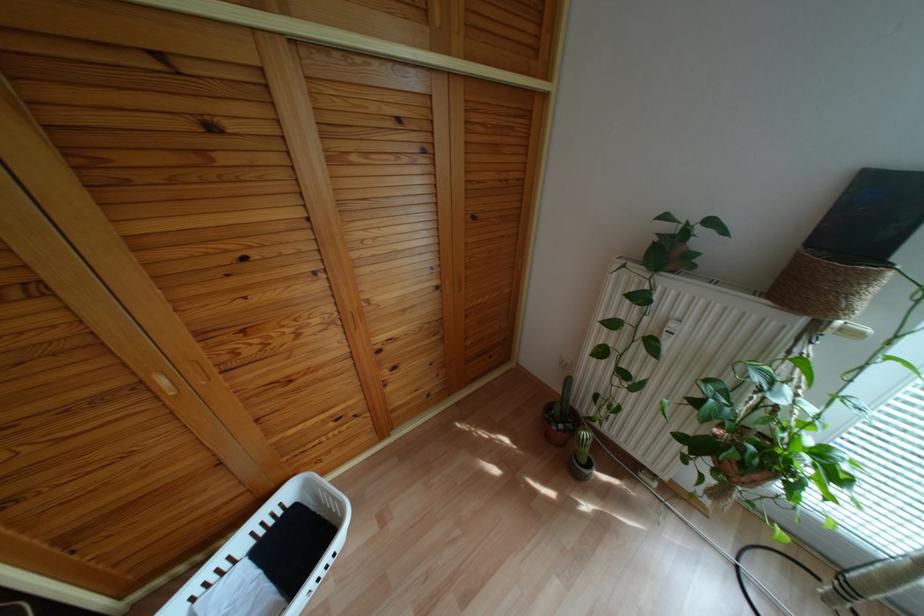
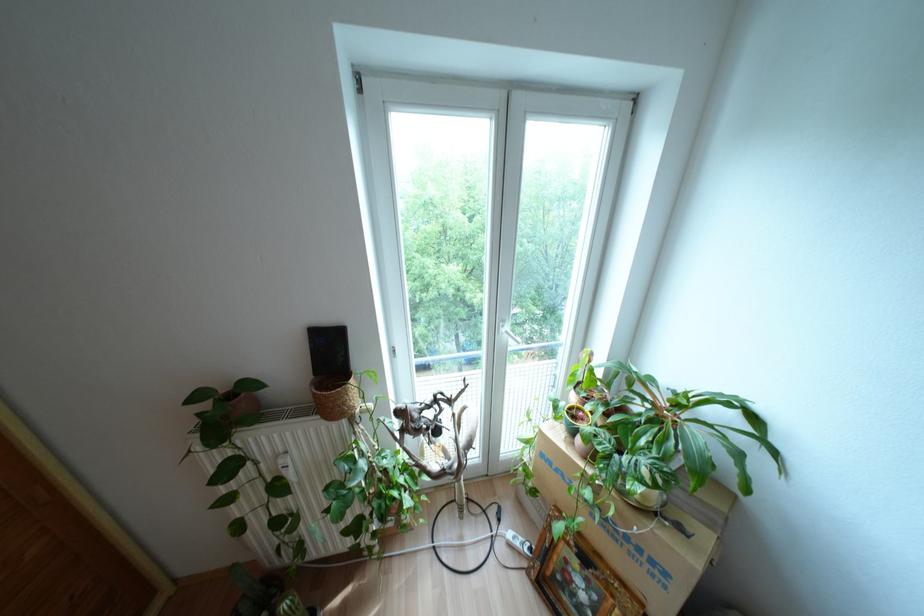
Question: The camera is either moving clockwise (left) or counter-clockwise (right) around the object. The first image is from the beginning of the video and the second image is from the end. Is the camera moving left or right when shooting the video?

Choices:
 (A) Left
 (B) Right

Answer: (A)